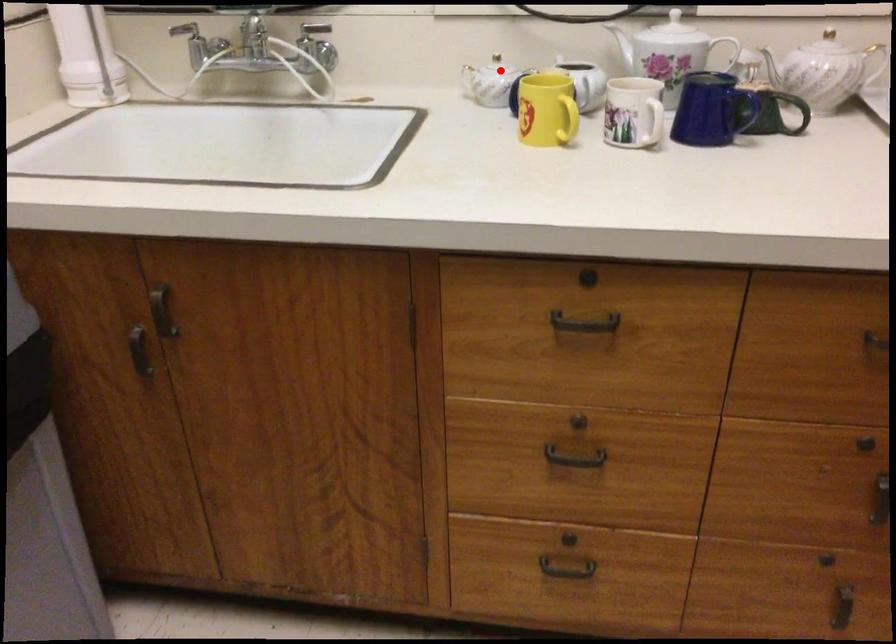
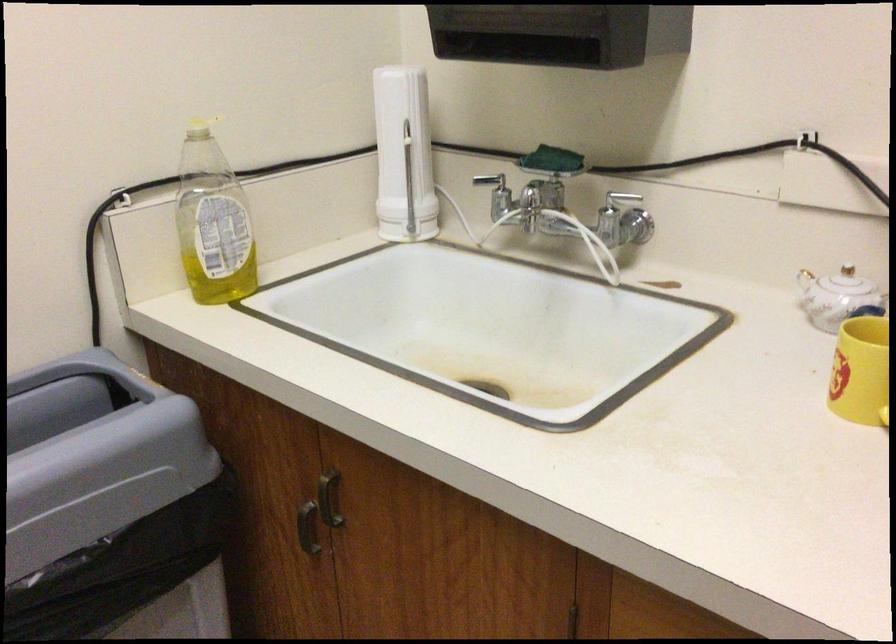
Question: I am providing you with two images of the same scene from different viewpoints. In image1, a red point is highlighted. Considering the same 3D point in image2, which of the following is correct?

Choices:
 (A) It is closer
 (B) It is farther

Answer: (A)